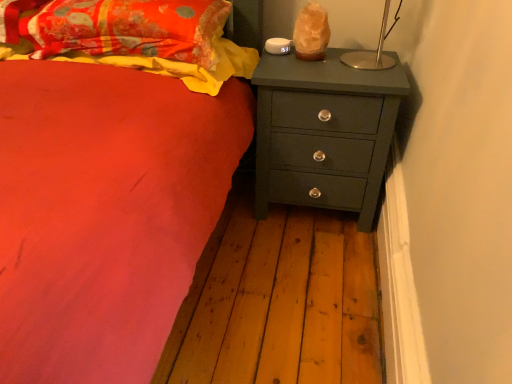
What do you see at coordinates (185, 66) in the screenshot? The height and width of the screenshot is (384, 512). I see `fluffy cotton blanket at upper left` at bounding box center [185, 66].

Find the location of a particular element. floral fabric pillow at upper left is located at coordinates (127, 28).

Does floral fabric pillow at upper left lie behind matte dark green chest of drawers at right?

No, it is in front of matte dark green chest of drawers at right.

From a real-world perspective, which object stands above the other?

From a 3D spatial view, floral fabric pillow at upper left is above.

Looking at their sizes, would you say floral fabric pillow at upper left is wider or thinner than matte dark green chest of drawers at right?

In the image, floral fabric pillow at upper left appears to be more narrow than matte dark green chest of drawers at right.

Is floral fabric pillow at upper left to the right of matte dark green chest of drawers at right from the viewer's perspective?

No.

From the image's perspective, which one is positioned lower, matte dark green chest of drawers at right or floral fabric pillow at upper left?

matte dark green chest of drawers at right is shown below in the image.

Which is closer, (303, 135) or (44, 7)?

The point (44, 7) is closer.

Where is `chest of drawers below the floral fabric pillow at upper left (from the image's perspective)`? chest of drawers below the floral fabric pillow at upper left (from the image's perspective) is located at coordinates (324, 132).

From a real-world perspective, which is physically above, floral fabric pillow at upper left or fluffy cotton blanket at upper left?

floral fabric pillow at upper left.

From the image's perspective, would you say floral fabric pillow at upper left is shown under fluffy cotton blanket at upper left?

No, from the image's perspective, floral fabric pillow at upper left is not below fluffy cotton blanket at upper left.

Does floral fabric pillow at upper left have a lesser width compared to fluffy cotton blanket at upper left?

Yes.

Choose the correct answer: Is floral fabric pillow at upper left inside fluffy cotton blanket at upper left or outside it?

floral fabric pillow at upper left cannot be found inside fluffy cotton blanket at upper left.

Which object is positioned more to the left, fluffy cotton blanket at upper left or floral fabric pillow at upper left?

floral fabric pillow at upper left.

Which is less distant, (207, 88) or (142, 48)?

Point (207, 88)

Considering the sizes of fluffy cotton blanket at upper left and floral fabric pillow at upper left in the image, is fluffy cotton blanket at upper left taller or shorter than floral fabric pillow at upper left?

Clearly, fluffy cotton blanket at upper left is shorter compared to floral fabric pillow at upper left.

Could you tell me if fluffy cotton blanket at upper left is facing floral fabric pillow at upper left?

No, fluffy cotton blanket at upper left is not turned towards floral fabric pillow at upper left.

Who is taller, fluffy cotton blanket at upper left or matte dark green chest of drawers at right?

matte dark green chest of drawers at right.

Is fluffy cotton blanket at upper left facing away from matte dark green chest of drawers at right?

No, matte dark green chest of drawers at right is not at the back of fluffy cotton blanket at upper left.

Considering the relative positions of fluffy cotton blanket at upper left and matte dark green chest of drawers at right in the image provided, is fluffy cotton blanket at upper left to the right of matte dark green chest of drawers at right from the viewer's perspective?

No.

Considering their positions, is fluffy cotton blanket at upper left located in front of or behind matte dark green chest of drawers at right?

In the image, fluffy cotton blanket at upper left appears in front of matte dark green chest of drawers at right.

Is matte dark green chest of drawers at right oriented away from fluffy cotton blanket at upper left?

No, matte dark green chest of drawers at right's orientation is not away from fluffy cotton blanket at upper left.

Is fluffy cotton blanket at upper left completely or partially inside matte dark green chest of drawers at right?

No, fluffy cotton blanket at upper left is not inside matte dark green chest of drawers at right.

Based on their sizes in the image, would you say matte dark green chest of drawers at right is bigger or smaller than fluffy cotton blanket at upper left?

Clearly, matte dark green chest of drawers at right is larger in size than fluffy cotton blanket at upper left.

I want to click on the chest of drawers that appears behind the floral fabric pillow at upper left, so click(x=324, y=132).

The height and width of the screenshot is (384, 512). I want to click on the chest of drawers located below the floral fabric pillow at upper left (from the image's perspective), so click(x=324, y=132).

Estimate the real-world distances between objects in this image. Which object is further from fluffy cotton blanket at upper left, matte dark green chest of drawers at right or floral fabric pillow at upper left?

matte dark green chest of drawers at right is further to fluffy cotton blanket at upper left.

Which object lies nearer to the anchor point floral fabric pillow at upper left, fluffy cotton blanket at upper left or matte dark green chest of drawers at right?

The object closer to floral fabric pillow at upper left is fluffy cotton blanket at upper left.

Estimate the real-world distances between objects in this image. Which object is further from fluffy cotton blanket at upper left, floral fabric pillow at upper left or matte dark green chest of drawers at right?

matte dark green chest of drawers at right is further to fluffy cotton blanket at upper left.

Looking at the image, which one is located further to matte dark green chest of drawers at right, floral fabric pillow at upper left or fluffy cotton blanket at upper left?

floral fabric pillow at upper left is further to matte dark green chest of drawers at right.

Estimate the real-world distances between objects in this image. Which object is further from matte dark green chest of drawers at right, fluffy cotton blanket at upper left or floral fabric pillow at upper left?

floral fabric pillow at upper left.

When comparing their distances from floral fabric pillow at upper left, does matte dark green chest of drawers at right or fluffy cotton blanket at upper left seem further?

matte dark green chest of drawers at right.

At what (x,y) coordinates should I click in order to perform the action: click on blanket between floral fabric pillow at upper left and matte dark green chest of drawers at right from left to right. Please return your answer as a coordinate pair (x, y). Looking at the image, I should click on (185, 66).